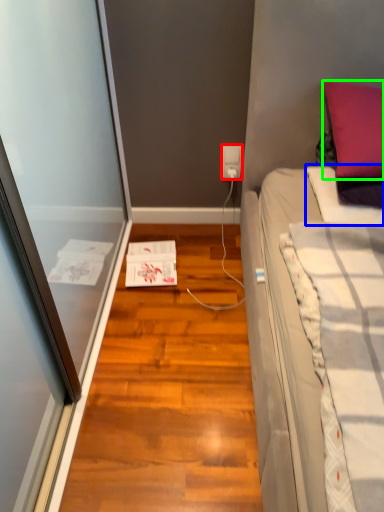
Question: Based on their relative distances, which object is farther from power outlet (highlighted by a red box)? Choose from blanket (highlighted by a blue box) and pillow (highlighted by a green box).

Choices:
 (A) blanket
 (B) pillow

Answer: (B)